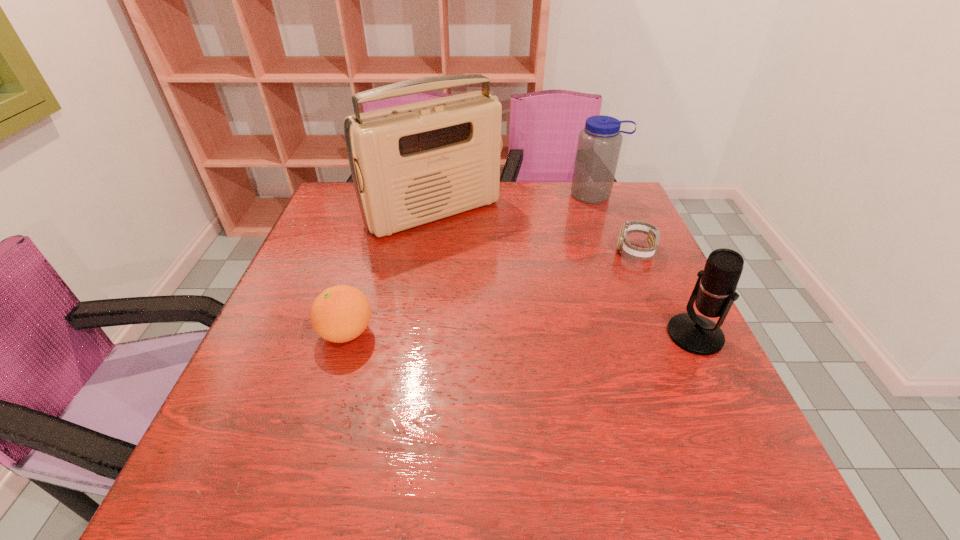
Locate an element on the screen. The image size is (960, 540). vacant space on the desktop that is between the orange and the microphone and is positioned on the front-facing side of the radio receiver is located at coordinates (547, 334).

Where is `vacant spot on the desktop that is between the second shortest object and the microphone and is positioned on the face of the watch`? This screenshot has height=540, width=960. vacant spot on the desktop that is between the second shortest object and the microphone and is positioned on the face of the watch is located at coordinates click(x=468, y=333).

This screenshot has width=960, height=540. Find the location of `vacant spot on the desktop that is between the orange and the microphone and is positioned with a carrying loop on the side of the water bottle`. vacant spot on the desktop that is between the orange and the microphone and is positioned with a carrying loop on the side of the water bottle is located at coordinates (570, 334).